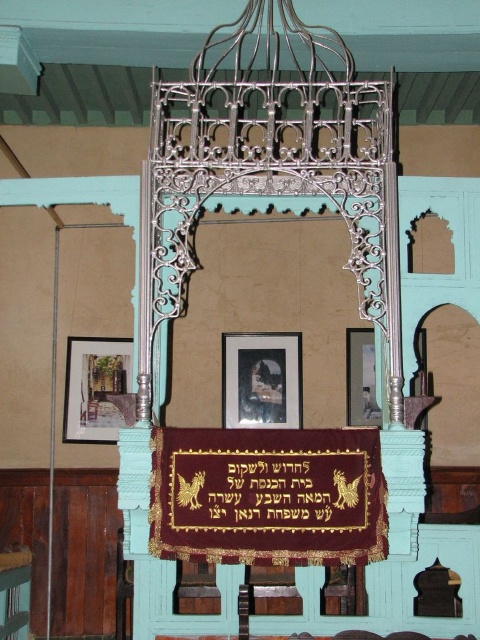
Can you confirm if matte wooden picture frame at lower left is bigger than metallic frame at center?

Yes, matte wooden picture frame at lower left is bigger than metallic frame at center.

Is matte wooden picture frame at lower left wider than metallic frame at center?

Yes, matte wooden picture frame at lower left is wider than metallic frame at center.

Locate an element on the screen. The image size is (480, 640). matte wooden picture frame at lower left is located at coordinates (97, 388).

Can you confirm if goldmaterial/texturescroll at center is positioned below metallic frame at center?

Yes.

Between goldmaterial/texturescroll at center and metallic frame at center, which one has less height?

Standing shorter between the two is goldmaterial/texturescroll at center.

Who is more distant from viewer, (301, 468) or (367, 349)?

The point (367, 349) is more distant.

Where is `goldmaterial/texturescroll at center`? goldmaterial/texturescroll at center is located at coordinates (271, 492).

Does goldmaterial/texturescroll at center appear on the right side of matte wooden picture frame at lower left?

Yes, goldmaterial/texturescroll at center is to the right of matte wooden picture frame at lower left.

Between goldmaterial/texturescroll at center and matte wooden picture frame at lower left, which one is positioned lower?

goldmaterial/texturescroll at center is below.

Locate an element on the screen. Image resolution: width=480 pixels, height=640 pixels. goldmaterial/texturescroll at center is located at coordinates (271, 492).

Where is `goldmaterial/texturescroll at center`? Image resolution: width=480 pixels, height=640 pixels. goldmaterial/texturescroll at center is located at coordinates [x=271, y=492].